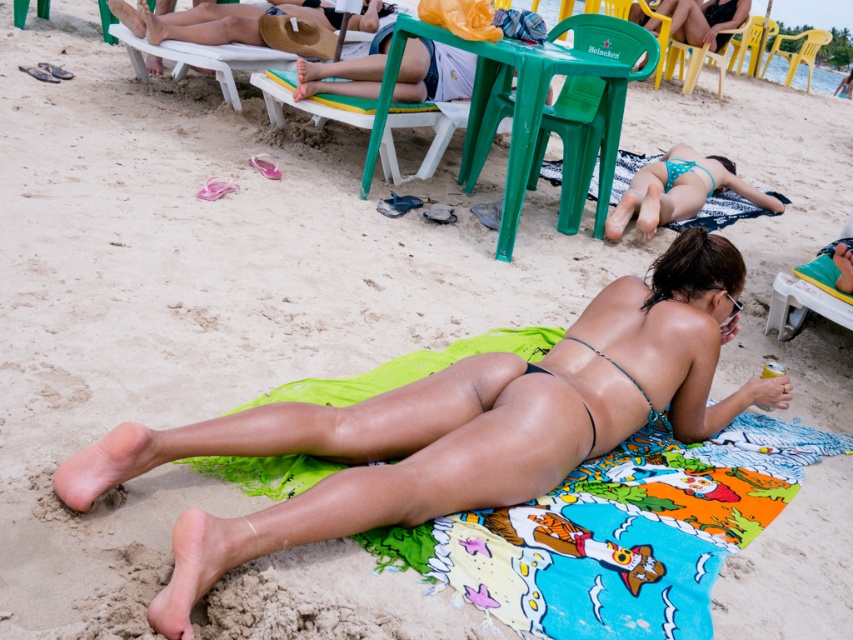
Does point (534, 147) come farther from viewer compared to point (639, 172)?

No.

The height and width of the screenshot is (640, 853). Describe the element at coordinates (556, 115) in the screenshot. I see `green plastic chair at center` at that location.

Locate an element on the screen. green plastic chair at center is located at coordinates (556, 115).

Can you confirm if yellow plastic beach chair at upper right is bigger than blue shiny bikini at center?

Correct, yellow plastic beach chair at upper right is larger in size than blue shiny bikini at center.

Between point (805, 42) and point (672, 166), which one is positioned behind?

Positioned behind is point (805, 42).

Is point (796, 54) in front of point (666, 186)?

No, it is not.

At what (x,y) coordinates should I click in order to perform the action: click on yellow plastic beach chair at upper right. Please return your answer as a coordinate pair (x, y). Looking at the image, I should click on (798, 51).

Is green plastic chair at center bigger than green plastic beach chair at center?

Yes, green plastic chair at center is bigger than green plastic beach chair at center.

From the picture: Does green plastic chair at center appear on the right side of green plastic beach chair at center?

Indeed, green plastic chair at center is positioned on the right side of green plastic beach chair at center.

Is point (567, 164) positioned before point (401, 68)?

That is True.

This screenshot has width=853, height=640. I want to click on green plastic chair at center, so click(556, 115).